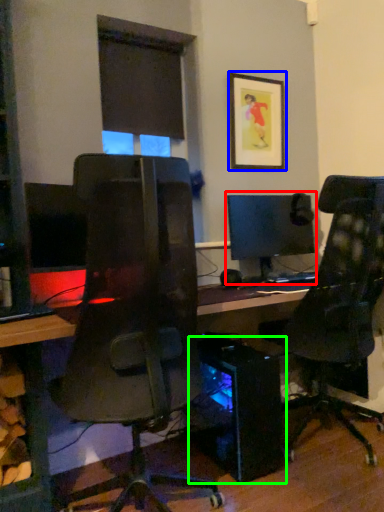
Question: Which object is the closest to the computer monitor (highlighted by a red box)? Choose among these: picture frame (highlighted by a blue box) or computer tower (highlighted by a green box).

Choices:
 (A) picture frame
 (B) computer tower

Answer: (A)